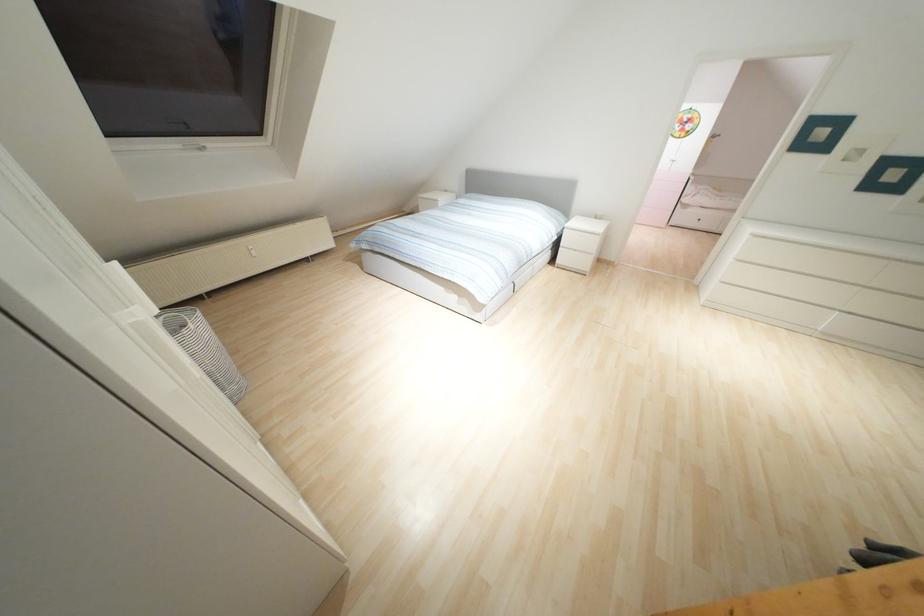
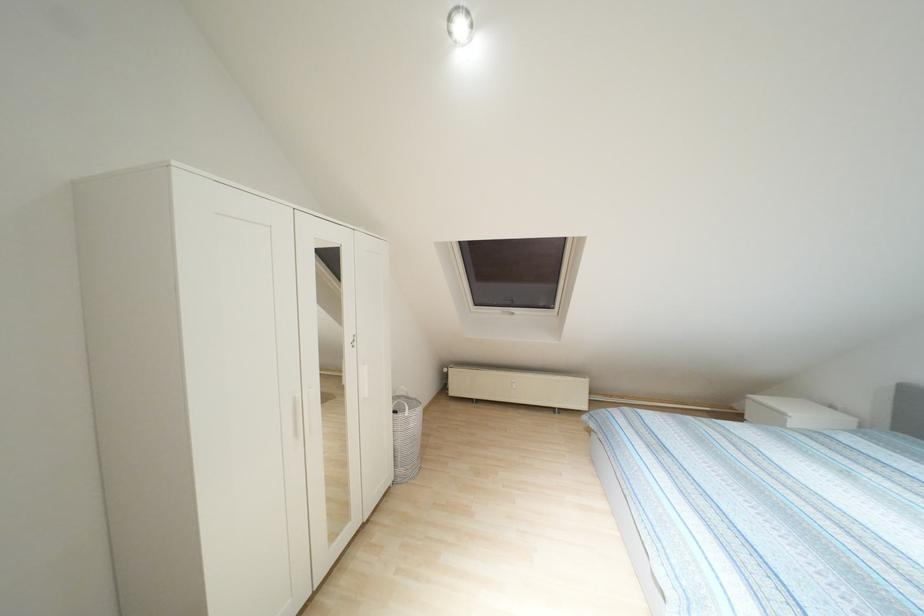
Question: Based on the continuous images, in which direction is the camera rotating? Reply with the corresponding letter.

Choices:
 (A) Left
 (B) Right
 (C) Up
 (D) Down

Answer: (A)